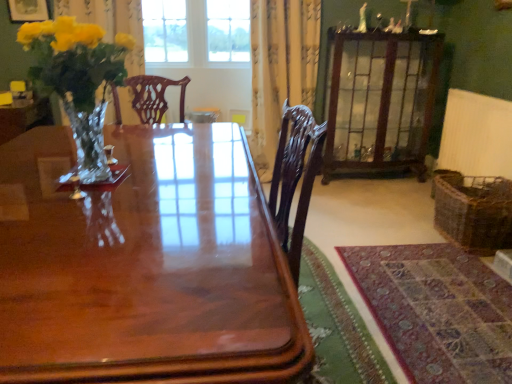
Identify the location of free space in front of shiny glass vase with yellow flowers at left. The image size is (512, 384). (75, 214).